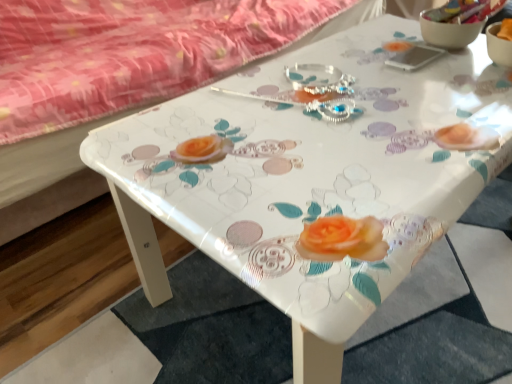
Identify the location of white glossy bowl at upper right. click(448, 32).

Describe the element at coordinates (448, 32) in the screenshot. The height and width of the screenshot is (384, 512). I see `white glossy bowl at upper right` at that location.

The height and width of the screenshot is (384, 512). What are the coordinates of `white glossy bowl at upper right` in the screenshot? It's located at (448, 32).